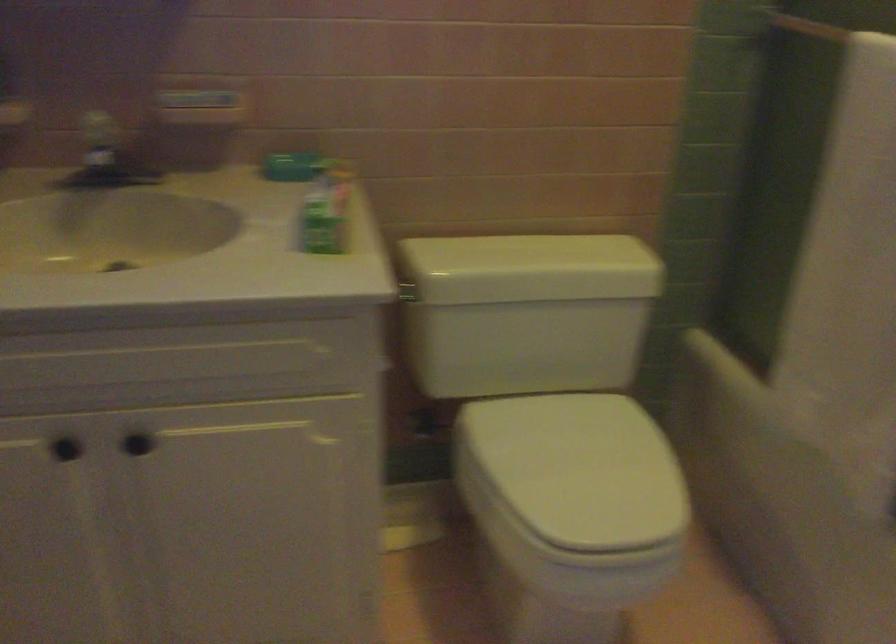
The image size is (896, 644). I want to click on white toilet tank lid, so click(x=530, y=268).